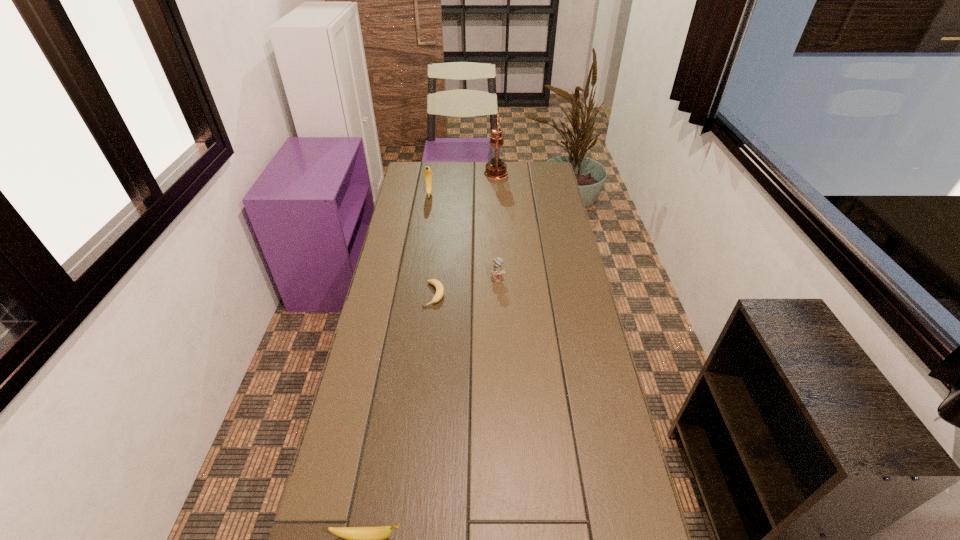
I want to click on free space located 0.220m at the stem of the second nearest banana, so click(427, 360).

What are the coordinates of `object located at the far edge` in the screenshot? It's located at (496, 168).

The width and height of the screenshot is (960, 540). I want to click on object situated at the left edge, so click(x=427, y=172).

Identify the location of free space at the left edge. (433, 187).

I want to click on vacant area at the right edge of the desktop, so click(540, 233).

Locate an element on the screen. The image size is (960, 540). blank space at the far right corner is located at coordinates (547, 165).

The height and width of the screenshot is (540, 960). What are the coordinates of `vacant space that is in between the farthest object and the third shortest object` in the screenshot? It's located at (497, 226).

You are a GUI agent. You are given a task and a screenshot of the screen. Output one action in this format:
    pyautogui.click(x=<x>, y=<y>)
    Task: Click on the free space between the second farthest object and the third shortest object
    The image size is (960, 540).
    Given the screenshot: What is the action you would take?
    pyautogui.click(x=464, y=237)

The height and width of the screenshot is (540, 960). In order to click on free space that is in between the teddy bear and the shortest object in this screenshot , I will do coord(466,287).

At what (x,y) coordinates should I click in order to perform the action: click on empty space that is in between the tallest banana and the shortest banana. Please return your answer as a coordinate pair (x, y). This screenshot has height=540, width=960. Looking at the image, I should click on (432, 245).